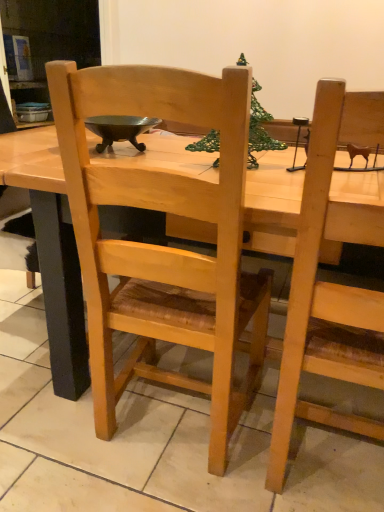
The image size is (384, 512). I want to click on vacant space to the right of natural wood chair at center, so click(x=302, y=449).